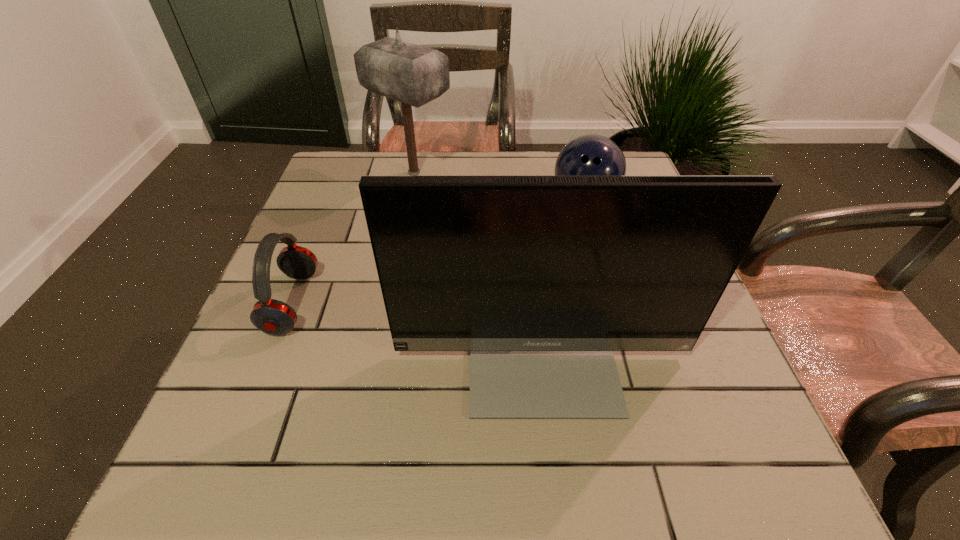
This screenshot has height=540, width=960. I want to click on mallet, so click(414, 75).

The image size is (960, 540). I want to click on computer monitor, so click(x=541, y=278).

The image size is (960, 540). Find the location of `bowling ball`. bowling ball is located at coordinates (589, 155).

This screenshot has width=960, height=540. Find the location of `the leftmost object`. the leftmost object is located at coordinates (272, 316).

You are a GUI agent. You are given a task and a screenshot of the screen. Output one action in this format:
    pyautogui.click(x=<x>, y=<y>)
    Task: Click on the vacant space located 0.190m on the right of the mallet
    The height and width of the screenshot is (540, 960).
    Given the screenshot: What is the action you would take?
    pyautogui.click(x=522, y=173)

Find the location of a particular element. vacant position located on the screen of the computer monitor is located at coordinates (554, 463).

The width and height of the screenshot is (960, 540). What are the coordinates of `blank space located on the surface of the bowling ball near the finger holes` in the screenshot? It's located at (605, 274).

Find the location of a particular element. This screenshot has height=540, width=960. vacant space located on the ear cups of the leftmost object is located at coordinates (459, 302).

Where is `mallet that is at the far edge`? mallet that is at the far edge is located at coordinates (414, 75).

Locate an element on the screen. The width and height of the screenshot is (960, 540). bowling ball present at the far edge is located at coordinates (589, 155).